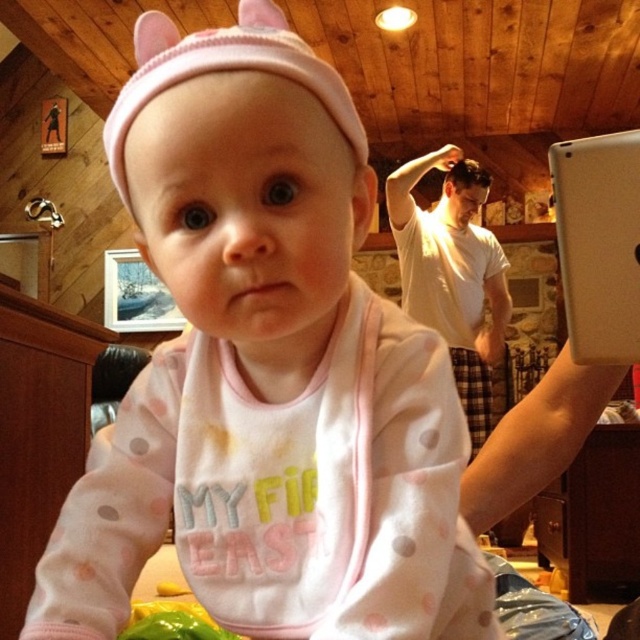
You are standing in the cozy indoor setting described. You notice two points marked in the scene. Which point is closer to you, point (308,516) or point (595,284)?

Point (308,516) is in front of point (595,284), so it is closer to you.

In the scene shown: You are a tailor measuring fabrics for a baby. You have two items to work on today. The first is the pink fabric bib at center, and the second is the pink knit hat at upper center. Which item requires more vertical fabric space when laying it out flat?

The pink fabric bib at center requires more vertical fabric space because it has a greater height compared to the pink knit hat at upper center.

You are a delivery person holding a package that requires a signature. You need to place it on the white matte tablet at upper right, which is 66.85 centimeters away from you. Can you reach it without moving your position?

The white matte tablet at upper right is 66.85 centimeters from the viewer. Since the average human arm length is about 60 centimeters, you may need to stretch slightly but it should be reachable if you extend your arm fully.